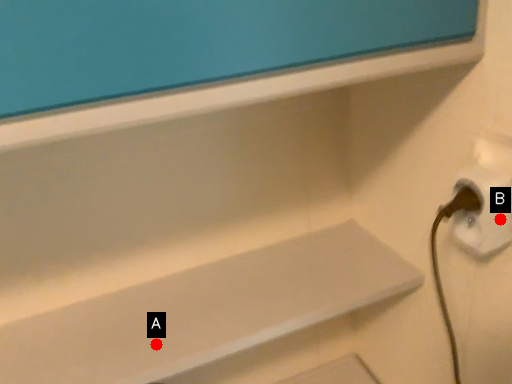
Question: Two points are circled on the image, labeled by A and B beside each circle. Which of the following is the farthest from the observer?

Choices:
 (A) A is further
 (B) B is further

Answer: (A)